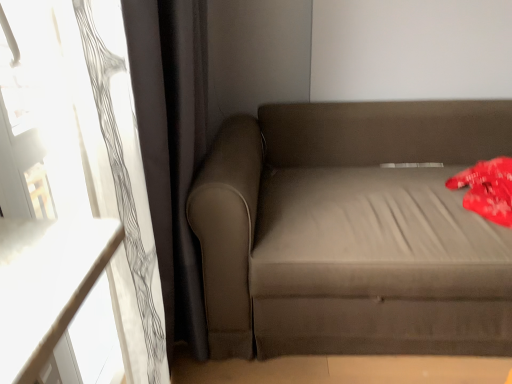
What do you see at coordinates (352, 231) in the screenshot?
I see `suede-like beige studio couch at center` at bounding box center [352, 231].

In order to click on suede-like beige studio couch at center in this screenshot , I will do point(352,231).

In order to click on suede-like beige studio couch at center in this screenshot , I will do `click(352, 231)`.